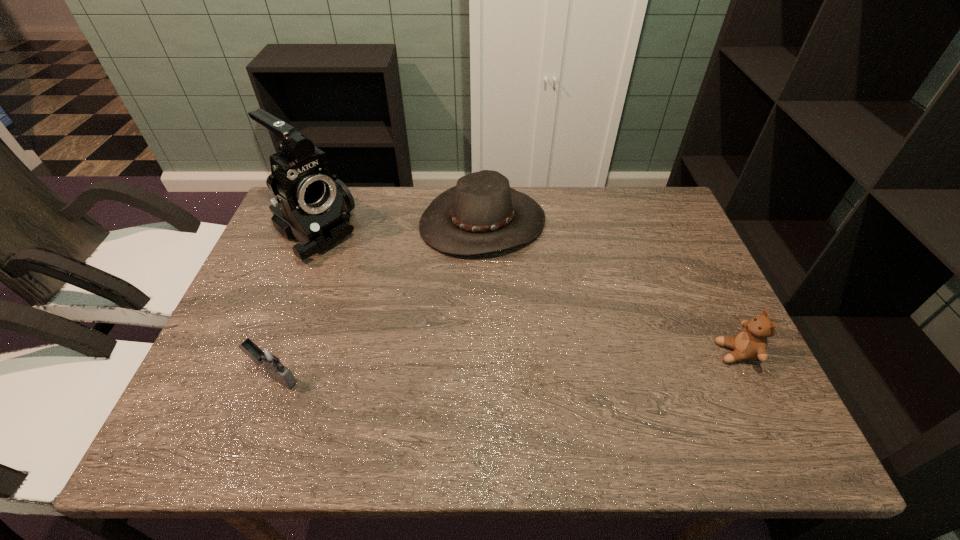
Find the location of a particular element. igniter is located at coordinates (267, 357).

In order to click on teddy bear in this screenshot , I will do `click(751, 343)`.

Locate an element on the screen. the tallest object is located at coordinates (312, 206).

Identify the location of the third object from left to right. The height and width of the screenshot is (540, 960). (482, 214).

Where is `blank space located 0.120m on the right of the igniter`? The height and width of the screenshot is (540, 960). blank space located 0.120m on the right of the igniter is located at coordinates (355, 376).

Where is `free space located 0.250m on the front-facing side of the rightmost object`? This screenshot has width=960, height=540. free space located 0.250m on the front-facing side of the rightmost object is located at coordinates (607, 353).

Where is `vacant point located on the front-facing side of the rightmost object`? The height and width of the screenshot is (540, 960). vacant point located on the front-facing side of the rightmost object is located at coordinates (580, 353).

Find the location of a particular element. This screenshot has width=960, height=540. free location located on the front-facing side of the rightmost object is located at coordinates (593, 353).

Where is `vacant space located on the lens mount of the tallest object`? vacant space located on the lens mount of the tallest object is located at coordinates (405, 305).

Image resolution: width=960 pixels, height=540 pixels. Find the location of `blank space located on the lens mount of the tallest object`. blank space located on the lens mount of the tallest object is located at coordinates (357, 269).